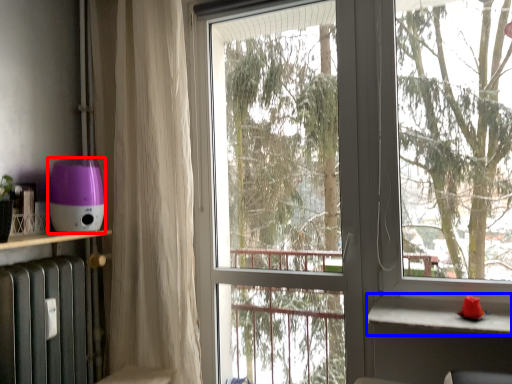
Question: Which object appears closest to the camera in this image, appliance (highlighted by a red box) or window sill (highlighted by a blue box)?

Choices:
 (A) appliance
 (B) window sill

Answer: (B)